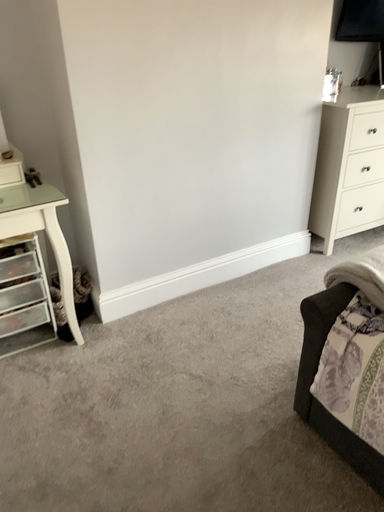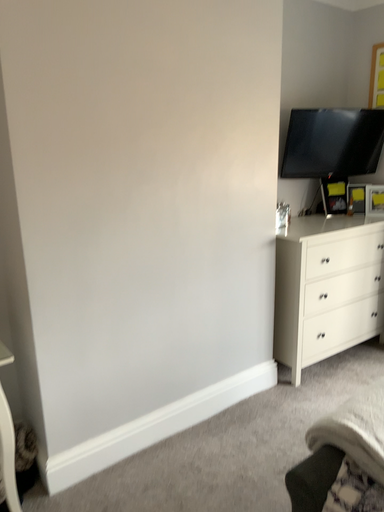
Question: Which way did the camera rotate in the video?

Choices:
 (A) rotated upward
 (B) rotated downward

Answer: (A)